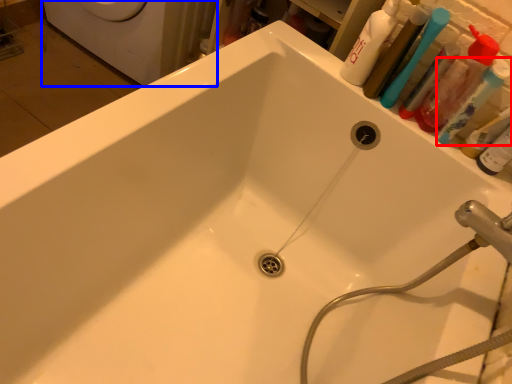
Question: Which point is further to the camera, toothbrush (highlighted by a red box) or washing machine (highlighted by a blue box)?

Choices:
 (A) toothbrush
 (B) washing machine

Answer: (B)